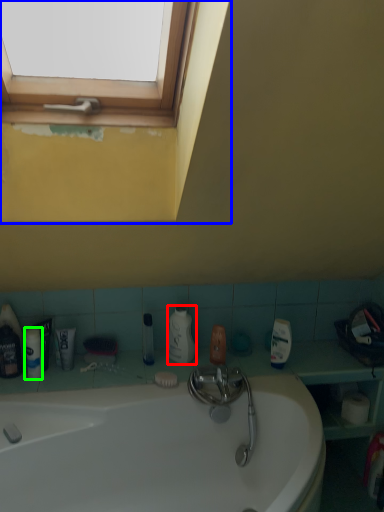
Question: Estimate the real-world distances between objects in this image. Which object is closer to cleaning product (highlighted by a red box), window frame (highlighted by a blue box) or toiletry (highlighted by a green box)?

Choices:
 (A) window frame
 (B) toiletry

Answer: (B)